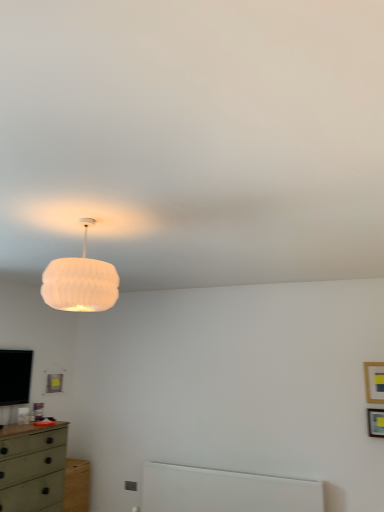
Identify the location of wooden picture frame at upper right, the 2th picture frame ordered from the bottom. This screenshot has width=384, height=512. (374, 382).

This screenshot has height=512, width=384. What do you see at coordinates (375, 422) in the screenshot?
I see `wooden picture frame at upper right, which appears as the second picture frame when viewed from the top` at bounding box center [375, 422].

The height and width of the screenshot is (512, 384). In order to click on green matte chest of drawers at lower left in this screenshot , I will do `click(33, 469)`.

Find the location of a particular element. This screenshot has width=384, height=512. wooden picture frame at upper right, which is the first picture frame from top to bottom is located at coordinates (374, 382).

Is wooden picture frame at upper right, which is the first picture frame from top to bottom, next to white ribbed shade at upper center?

No, wooden picture frame at upper right, which is the first picture frame from top to bottom, is not beside white ribbed shade at upper center.

Does point (370, 376) lie behind point (53, 278)?

That is True.

From the image's perspective, does wooden picture frame at upper right, the 2th picture frame ordered from the bottom, appear lower than white ribbed shade at upper center?

Indeed, from the image's perspective, wooden picture frame at upper right, the 2th picture frame ordered from the bottom, is shown beneath white ribbed shade at upper center.

Choose the correct answer: Is wooden picture frame at upper right, which is the first picture frame from top to bottom, inside white ribbed shade at upper center or outside it?

wooden picture frame at upper right, which is the first picture frame from top to bottom, is located beyond the bounds of white ribbed shade at upper center.

From the image's perspective, who appears lower, wooden picture frame at upper right, positioned as the first picture frame in bottom-to-top order, or green matte chest of drawers at lower left?

green matte chest of drawers at lower left is shown below in the image.

Consider the image. Who is shorter, wooden picture frame at upper right, which appears as the second picture frame when viewed from the top, or green matte chest of drawers at lower left?

wooden picture frame at upper right, which appears as the second picture frame when viewed from the top, is shorter.

Considering the sizes of objects wooden picture frame at upper right, positioned as the first picture frame in bottom-to-top order, and green matte chest of drawers at lower left in the image provided, who is bigger, wooden picture frame at upper right, positioned as the first picture frame in bottom-to-top order, or green matte chest of drawers at lower left?

green matte chest of drawers at lower left.

Is wooden picture frame at upper right, which appears as the second picture frame when viewed from the top, in front of green matte chest of drawers at lower left?

No, wooden picture frame at upper right, which appears as the second picture frame when viewed from the top, is behind green matte chest of drawers at lower left.

Is white ribbed shade at upper center facing towards wooden picture frame at upper right, positioned as the first picture frame in bottom-to-top order?

No, white ribbed shade at upper center is not aimed at wooden picture frame at upper right, positioned as the first picture frame in bottom-to-top order.

Does white ribbed shade at upper center have a lesser height compared to wooden picture frame at upper right, which appears as the second picture frame when viewed from the top?

No, white ribbed shade at upper center is not shorter than wooden picture frame at upper right, which appears as the second picture frame when viewed from the top.

From a real-world perspective, between white ribbed shade at upper center and wooden picture frame at upper right, positioned as the first picture frame in bottom-to-top order, who is vertically higher?

From a 3D spatial view, white ribbed shade at upper center is above.

From the image's perspective, does white ribbed shade at upper center appear higher than wooden picture frame at upper right, which appears as the second picture frame when viewed from the top?

Yes, from the image's perspective, white ribbed shade at upper center is over wooden picture frame at upper right, which appears as the second picture frame when viewed from the top.

Considering the relative sizes of white ribbed shade at upper center and green matte chest of drawers at lower left in the image provided, is white ribbed shade at upper center thinner than green matte chest of drawers at lower left?

Correct, the width of white ribbed shade at upper center is less than that of green matte chest of drawers at lower left.

Which object is closer to the camera taking this photo, white ribbed shade at upper center or green matte chest of drawers at lower left?

white ribbed shade at upper center is in front.

Which is behind, point (107, 304) or point (14, 500)?

The point (14, 500) is behind.

Based on the photo, which object is positioned more to the right, white ribbed shade at upper center or green matte chest of drawers at lower left?

Positioned to the right is white ribbed shade at upper center.

Is green matte chest of drawers at lower left to the left of wooden picture frame at upper right, which is the first picture frame from top to bottom, from the viewer's perspective?

Correct, you'll find green matte chest of drawers at lower left to the left of wooden picture frame at upper right, which is the first picture frame from top to bottom.

Is green matte chest of drawers at lower left not near wooden picture frame at upper right, the 2th picture frame ordered from the bottom?

Absolutely, green matte chest of drawers at lower left is distant from wooden picture frame at upper right, the 2th picture frame ordered from the bottom.

Can wooden picture frame at upper right, positioned as the first picture frame in bottom-to-top order, be found inside green matte chest of drawers at lower left?

No, wooden picture frame at upper right, positioned as the first picture frame in bottom-to-top order, is not inside green matte chest of drawers at lower left.

Does point (43, 438) appear closer or farther from the camera than point (369, 433)?

Point (43, 438) is positioned farther from the camera compared to point (369, 433).

Looking at this image, are green matte chest of drawers at lower left and wooden picture frame at upper right, positioned as the first picture frame in bottom-to-top order, located far from each other?

Yes, green matte chest of drawers at lower left is far from wooden picture frame at upper right, positioned as the first picture frame in bottom-to-top order.

From the image's perspective, which object appears higher, green matte chest of drawers at lower left or wooden picture frame at upper right, positioned as the first picture frame in bottom-to-top order?

wooden picture frame at upper right, positioned as the first picture frame in bottom-to-top order.

Is green matte chest of drawers at lower left smaller than white ribbed shade at upper center?

Incorrect, green matte chest of drawers at lower left is not smaller in size than white ribbed shade at upper center.

Who is taller, green matte chest of drawers at lower left or white ribbed shade at upper center?

green matte chest of drawers at lower left.

Is green matte chest of drawers at lower left at the left side of white ribbed shade at upper center?

Yes, green matte chest of drawers at lower left is to the left of white ribbed shade at upper center.

Is green matte chest of drawers at lower left beside white ribbed shade at upper center?

No, green matte chest of drawers at lower left is not beside white ribbed shade at upper center.

I want to click on lamp above the wooden picture frame at upper right, which is the first picture frame from top to bottom (from the image's perspective), so click(x=80, y=281).

What are the coordinates of `picture frame that is the 1st object above the green matte chest of drawers at lower left (from a real-world perspective)` in the screenshot? It's located at (375, 422).

From the image, which object appears to be nearer to white ribbed shade at upper center, green matte chest of drawers at lower left or wooden picture frame at upper right, which is the first picture frame from top to bottom?

green matte chest of drawers at lower left is closer to white ribbed shade at upper center.

Looking at the image, which one is located closer to wooden picture frame at upper right, which is the first picture frame from top to bottom, green matte chest of drawers at lower left or white ribbed shade at upper center?

white ribbed shade at upper center is positioned closer to the anchor wooden picture frame at upper right, which is the first picture frame from top to bottom.

Based on their spatial positions, is white ribbed shade at upper center or wooden picture frame at upper right, which appears as the second picture frame when viewed from the top, closer to wooden picture frame at upper right, the 2th picture frame ordered from the bottom?

wooden picture frame at upper right, which appears as the second picture frame when viewed from the top, lies closer to wooden picture frame at upper right, the 2th picture frame ordered from the bottom, than the other object.

Considering their positions, is wooden picture frame at upper right, which appears as the second picture frame when viewed from the top, positioned closer to green matte chest of drawers at lower left than white ribbed shade at upper center?

Among the two, white ribbed shade at upper center is located nearer to green matte chest of drawers at lower left.

Estimate the real-world distances between objects in this image. Which object is further from wooden picture frame at upper right, positioned as the first picture frame in bottom-to-top order, wooden picture frame at upper right, which is the first picture frame from top to bottom, or green matte chest of drawers at lower left?

green matte chest of drawers at lower left is positioned further to the anchor wooden picture frame at upper right, positioned as the first picture frame in bottom-to-top order.

Estimate the real-world distances between objects in this image. Which object is further from wooden picture frame at upper right, positioned as the first picture frame in bottom-to-top order, wooden picture frame at upper right, the 2th picture frame ordered from the bottom, or white ribbed shade at upper center?

white ribbed shade at upper center is further to wooden picture frame at upper right, positioned as the first picture frame in bottom-to-top order.

Based on the photo, considering their positions, is wooden picture frame at upper right, which is the first picture frame from top to bottom, positioned closer to white ribbed shade at upper center than wooden picture frame at upper right, which appears as the second picture frame when viewed from the top?

Based on the image, wooden picture frame at upper right, which is the first picture frame from top to bottom, appears to be nearer to white ribbed shade at upper center.

Which object lies further to the anchor point green matte chest of drawers at lower left, wooden picture frame at upper right, which is the first picture frame from top to bottom, or white ribbed shade at upper center?

wooden picture frame at upper right, which is the first picture frame from top to bottom, lies further to green matte chest of drawers at lower left than the other object.

Image resolution: width=384 pixels, height=512 pixels. Identify the location of picture frame between white ribbed shade at upper center and wooden picture frame at upper right, which is the first picture frame from top to bottom, from left to right. [375, 422].

This screenshot has height=512, width=384. What are the coordinates of `lamp located between green matte chest of drawers at lower left and wooden picture frame at upper right, which appears as the second picture frame when viewed from the top, in the left-right direction` in the screenshot? It's located at (80, 281).

Identify the location of picture frame between green matte chest of drawers at lower left and wooden picture frame at upper right, which is the first picture frame from top to bottom, from left to right. (375, 422).

Identify the location of lamp located between green matte chest of drawers at lower left and wooden picture frame at upper right, which is the first picture frame from top to bottom, in the left-right direction. The image size is (384, 512). (80, 281).